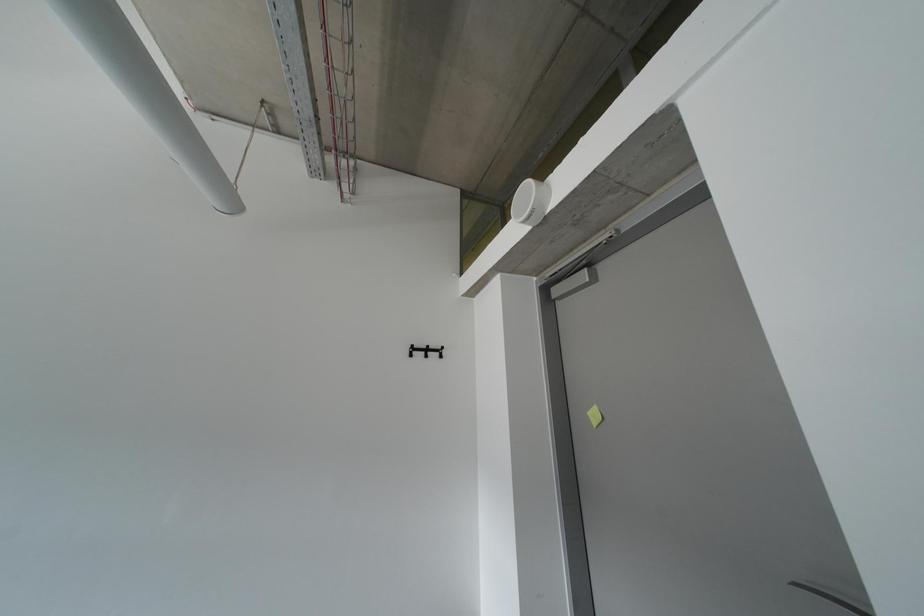
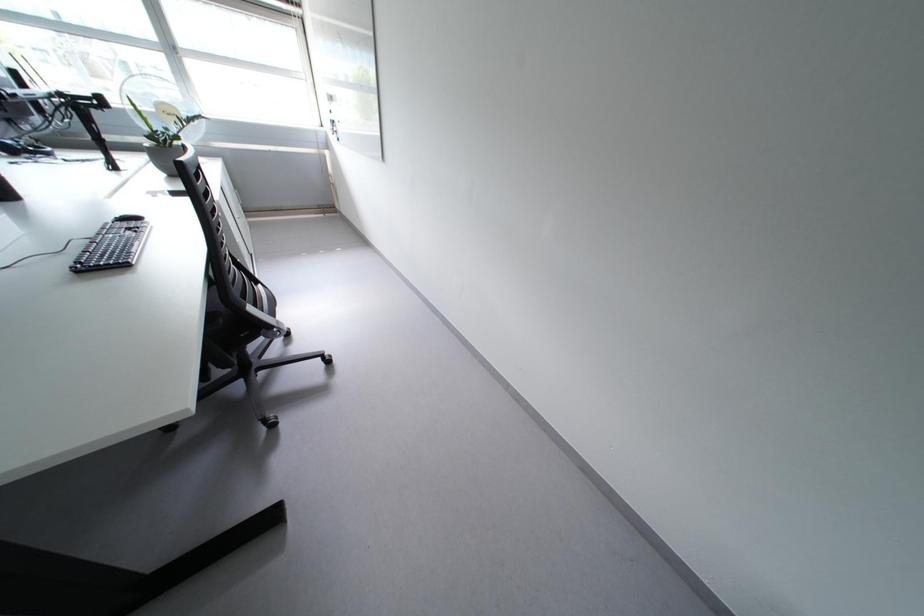
How did the camera likely rotate?

The camera's rotation is toward left-down.